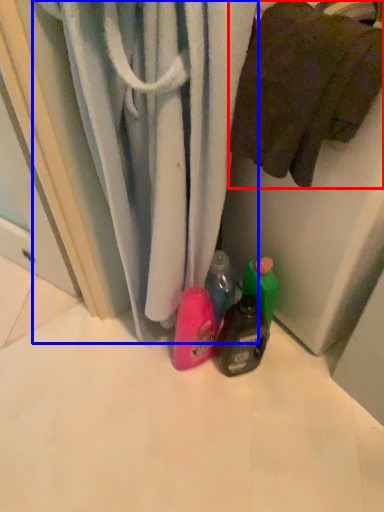
Question: Which of the following is the farthest to the observer, towel (highlighted by a red box) or curtain (highlighted by a blue box)?

Choices:
 (A) towel
 (B) curtain

Answer: (A)